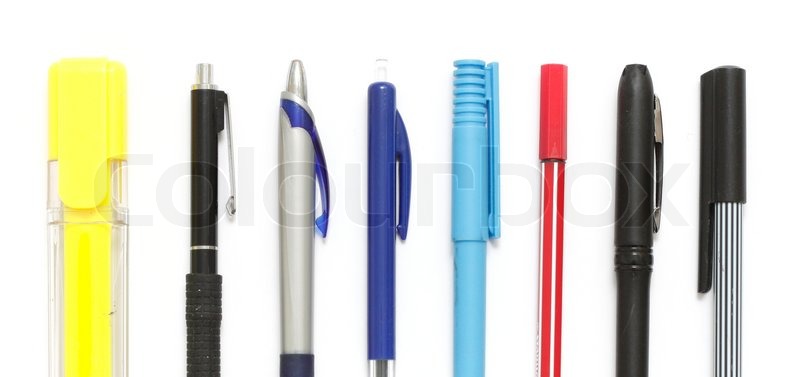
Locate an element on the screen. pens is located at coordinates tap(202, 297), tap(293, 281), tap(381, 289), tap(474, 239), tap(550, 246), tap(649, 250), tap(733, 256).